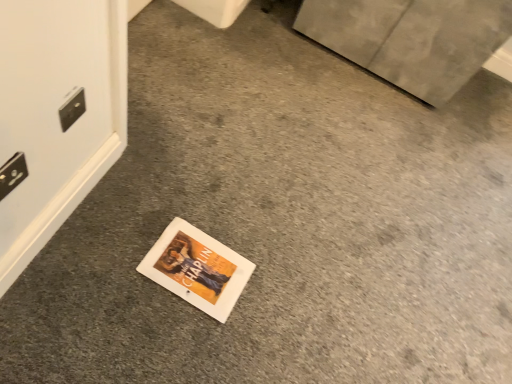
This screenshot has width=512, height=384. I want to click on black plastic electric outlet at lower left, which is the 1th electric outlet in left-to-right order, so click(x=12, y=174).

What is the approximate height of black plastic electric outlet at lower left, the 2th electric outlet when ordered from back to front?

9.99 centimeters.

Measure the distance between black plastic electric outlet at lower left, arranged as the first electric outlet when ordered from the bottom, and camera.

black plastic electric outlet at lower left, arranged as the first electric outlet when ordered from the bottom, and camera are 34.21 inches apart from each other.

What do you see at coordinates (12, 174) in the screenshot? The width and height of the screenshot is (512, 384). I see `black plastic electric outlet at lower left, which is the second electric outlet from right to left` at bounding box center [12, 174].

Describe the element at coordinates (72, 109) in the screenshot. I see `white plastic electric outlet at upper left, the 1th electric outlet from the top` at that location.

Find the location of `white plastic electric outlet at upper left, the second electric outlet when ordered from front to back`. white plastic electric outlet at upper left, the second electric outlet when ordered from front to back is located at coordinates pos(72,109).

How much space does white plastic electric outlet at upper left, which ranks as the second electric outlet in bottom-to-top order, occupy vertically?

white plastic electric outlet at upper left, which ranks as the second electric outlet in bottom-to-top order, is 3.66 inches tall.

What are the coordinates of `black plastic electric outlet at lower left, arranged as the first electric outlet when ordered from the bottom` in the screenshot? It's located at (12, 174).

In the image, is black plastic electric outlet at lower left, positioned as the 2th electric outlet in top-to-bottom order, on the left side or the right side of white plastic electric outlet at upper left, the second electric outlet when ordered from front to back?

black plastic electric outlet at lower left, positioned as the 2th electric outlet in top-to-bottom order, is positioned on white plastic electric outlet at upper left, the second electric outlet when ordered from front to back,'s left side.

Does black plastic electric outlet at lower left, arranged as the first electric outlet when ordered from the bottom, come behind white plastic electric outlet at upper left, which ranks as the second electric outlet in bottom-to-top order?

No.

Is point (20, 176) less distant than point (83, 102)?

Yes.

From the image's perspective, which is below, black plastic electric outlet at lower left, which is the second electric outlet from right to left, or white plastic electric outlet at upper left, marked as the 1th electric outlet in a back-to-front arrangement?

black plastic electric outlet at lower left, which is the second electric outlet from right to left.

From a real-world perspective, is black plastic electric outlet at lower left, which is the 1th electric outlet in left-to-right order, physically below white plastic electric outlet at upper left, which ranks as the second electric outlet in bottom-to-top order?

Correct, in the physical world, black plastic electric outlet at lower left, which is the 1th electric outlet in left-to-right order, is lower than white plastic electric outlet at upper left, which ranks as the second electric outlet in bottom-to-top order.

Can you confirm if black plastic electric outlet at lower left, the 1th electric outlet in the front-to-back sequence, is thinner than white plastic electric outlet at upper left, which ranks as the second electric outlet in bottom-to-top order?

Incorrect, the width of black plastic electric outlet at lower left, the 1th electric outlet in the front-to-back sequence, is not less than that of white plastic electric outlet at upper left, which ranks as the second electric outlet in bottom-to-top order.

In the scene shown: Between black plastic electric outlet at lower left, the 2th electric outlet when ordered from back to front, and white plastic electric outlet at upper left, marked as the 1th electric outlet in a back-to-front arrangement, which one has more height?

Standing taller between the two is black plastic electric outlet at lower left, the 2th electric outlet when ordered from back to front.

Who is smaller, black plastic electric outlet at lower left, positioned as the 2th electric outlet in top-to-bottom order, or white plastic electric outlet at upper left, positioned as the 1th electric outlet in right-to-left order?

Smaller between the two is white plastic electric outlet at upper left, positioned as the 1th electric outlet in right-to-left order.

Consider the image. Is black plastic electric outlet at lower left, which is the second electric outlet from right to left, completely or partially outside of white plastic electric outlet at upper left, marked as the 1th electric outlet in a back-to-front arrangement?

Yes, black plastic electric outlet at lower left, which is the second electric outlet from right to left, is not within white plastic electric outlet at upper left, marked as the 1th electric outlet in a back-to-front arrangement.

Would you say black plastic electric outlet at lower left, the 1th electric outlet in the front-to-back sequence, is a long distance from white plastic electric outlet at upper left, the second electric outlet when ordered from front to back?

They are positioned close to each other.

Could you tell me if black plastic electric outlet at lower left, positioned as the 2th electric outlet in top-to-bottom order, is turned towards white plastic electric outlet at upper left, the 1th electric outlet from the top?

No, black plastic electric outlet at lower left, positioned as the 2th electric outlet in top-to-bottom order, does not turn towards white plastic electric outlet at upper left, the 1th electric outlet from the top.

How different are the orientations of black plastic electric outlet at lower left, positioned as the 2th electric outlet in top-to-bottom order, and white plastic electric outlet at upper left, the second electric outlet when ordered from front to back, in degrees?

The facing directions of black plastic electric outlet at lower left, positioned as the 2th electric outlet in top-to-bottom order, and white plastic electric outlet at upper left, the second electric outlet when ordered from front to back, are 1.71 degrees apart.

How far apart are black plastic electric outlet at lower left, positioned as the 2th electric outlet in top-to-bottom order, and white plastic electric outlet at upper left, the 1th electric outlet from the top?

6.48 inches.

Locate an element on the screen. This screenshot has width=512, height=384. electric outlet on the left side of white plastic electric outlet at upper left, positioned as the 1th electric outlet in right-to-left order is located at coordinates (12, 174).

Which is more to the right, white plastic electric outlet at upper left, which ranks as the second electric outlet in bottom-to-top order, or black plastic electric outlet at lower left, which is the 1th electric outlet in left-to-right order?

white plastic electric outlet at upper left, which ranks as the second electric outlet in bottom-to-top order, is more to the right.

Who is more distant, white plastic electric outlet at upper left, the 1th electric outlet from the top, or black plastic electric outlet at lower left, arranged as the first electric outlet when ordered from the bottom?

white plastic electric outlet at upper left, the 1th electric outlet from the top, is behind.

Is point (76, 103) positioned after point (23, 170)?

That is True.

In the scene shown: From the image's perspective, would you say white plastic electric outlet at upper left, which ranks as the second electric outlet in bottom-to-top order, is shown under black plastic electric outlet at lower left, positioned as the 2th electric outlet in top-to-bottom order?

No, from the image's perspective, white plastic electric outlet at upper left, which ranks as the second electric outlet in bottom-to-top order, is not below black plastic electric outlet at lower left, positioned as the 2th electric outlet in top-to-bottom order.

From a real-world perspective, between white plastic electric outlet at upper left, marked as the 1th electric outlet in a back-to-front arrangement, and black plastic electric outlet at lower left, the 1th electric outlet in the front-to-back sequence, who is vertically lower?

black plastic electric outlet at lower left, the 1th electric outlet in the front-to-back sequence.

Which of these two, white plastic electric outlet at upper left, the 1th electric outlet from the top, or black plastic electric outlet at lower left, the 2th electric outlet when ordered from back to front, is wider?

With larger width is black plastic electric outlet at lower left, the 2th electric outlet when ordered from back to front.

From their relative heights in the image, would you say white plastic electric outlet at upper left, acting as the 2th electric outlet starting from the left, is taller or shorter than black plastic electric outlet at lower left, arranged as the first electric outlet when ordered from the bottom?

Considering their sizes, white plastic electric outlet at upper left, acting as the 2th electric outlet starting from the left, has less height than black plastic electric outlet at lower left, arranged as the first electric outlet when ordered from the bottom.

In terms of size, does white plastic electric outlet at upper left, acting as the 2th electric outlet starting from the left, appear bigger or smaller than black plastic electric outlet at lower left, which is the second electric outlet from right to left?

Clearly, white plastic electric outlet at upper left, acting as the 2th electric outlet starting from the left, is smaller in size than black plastic electric outlet at lower left, which is the second electric outlet from right to left.

Would you say white plastic electric outlet at upper left, acting as the 2th electric outlet starting from the left, is inside or outside black plastic electric outlet at lower left, positioned as the 2th electric outlet in top-to-bottom order?

white plastic electric outlet at upper left, acting as the 2th electric outlet starting from the left, exists outside the volume of black plastic electric outlet at lower left, positioned as the 2th electric outlet in top-to-bottom order.

Are white plastic electric outlet at upper left, the 1th electric outlet from the top, and black plastic electric outlet at lower left, positioned as the 2th electric outlet in top-to-bottom order, beside each other?

No, white plastic electric outlet at upper left, the 1th electric outlet from the top, is not in contact with black plastic electric outlet at lower left, positioned as the 2th electric outlet in top-to-bottom order.

Is white plastic electric outlet at upper left, the 1th electric outlet from the top, facing away from black plastic electric outlet at lower left, arranged as the first electric outlet when ordered from the bottom?

white plastic electric outlet at upper left, the 1th electric outlet from the top, does not have its back to black plastic electric outlet at lower left, arranged as the first electric outlet when ordered from the bottom.

Locate an element on the screen. This screenshot has height=384, width=512. electric outlet above the black plastic electric outlet at lower left, which is the second electric outlet from right to left (from the image's perspective) is located at coordinates (72, 109).

What are the coordinates of `electric outlet that appears on the left of white plastic electric outlet at upper left, which ranks as the second electric outlet in bottom-to-top order` in the screenshot? It's located at (12, 174).

Find the location of a particular element. The width and height of the screenshot is (512, 384). electric outlet below the white plastic electric outlet at upper left, positioned as the 1th electric outlet in right-to-left order (from a real-world perspective) is located at coordinates coord(12,174).